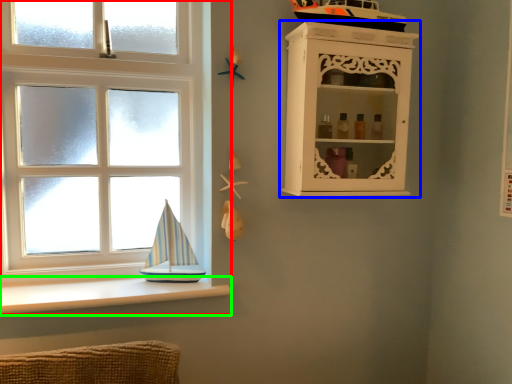
Question: Which object is positioned farthest from window (highlighted by a red box)? Select from shelf (highlighted by a blue box) and ledge (highlighted by a green box).

Choices:
 (A) shelf
 (B) ledge

Answer: (A)